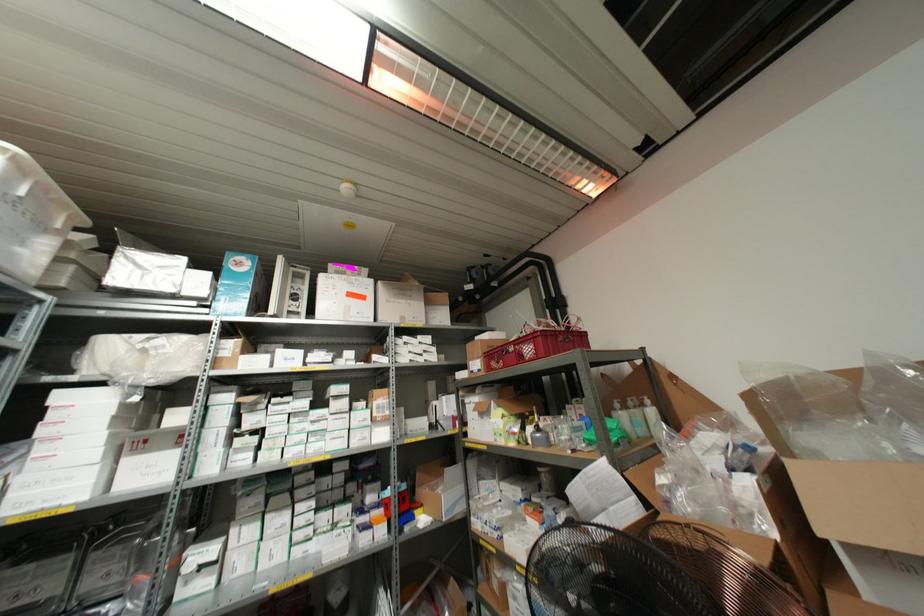
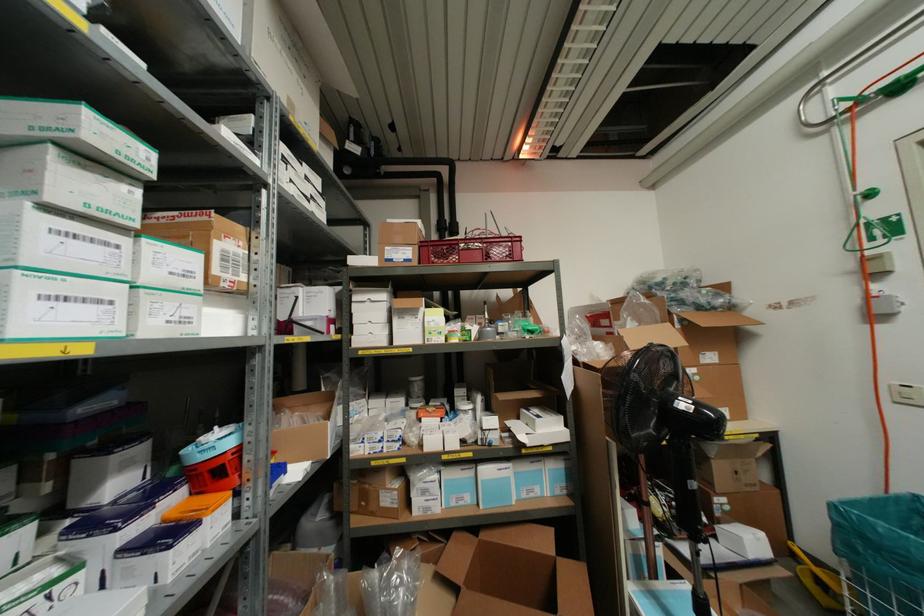
The point at [363,438] is marked in the first image. Where is the corresponding point in the second image?

(185, 320)